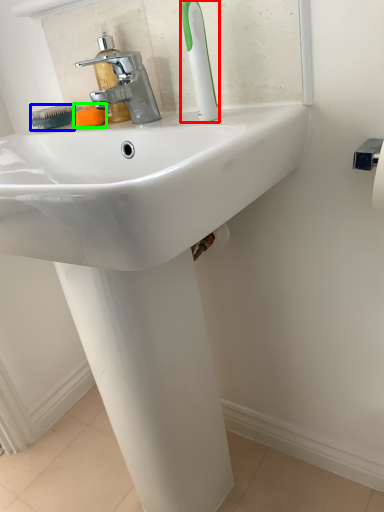
Question: Which object is the closest to the toothbrush (highlighted by a red box)? Choose among these: brush (highlighted by a blue box) or soap (highlighted by a green box).

Choices:
 (A) brush
 (B) soap

Answer: (B)